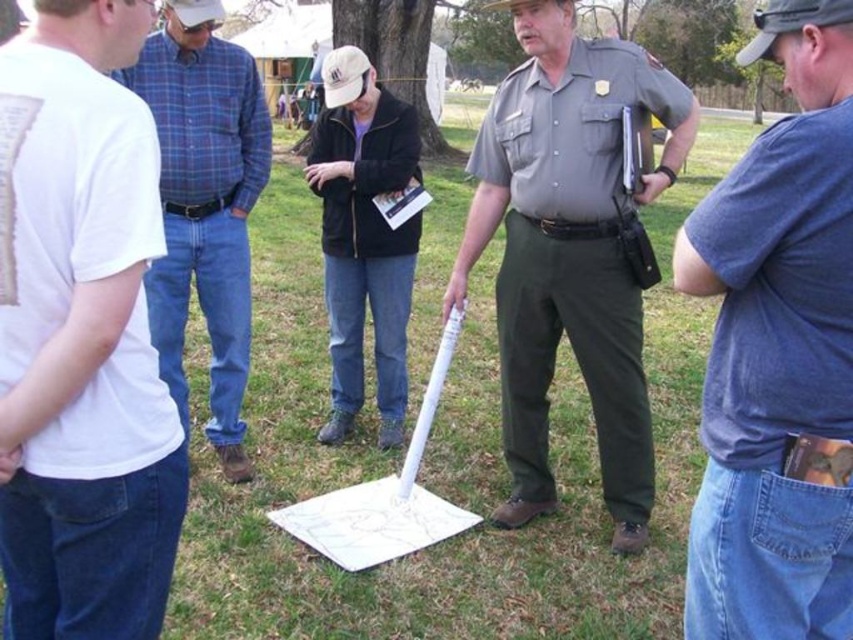
You are a photographer trying to capture a group photo of the blue plaid shirt at left and the black matte jacket at center. Which person should you position closer to the camera to ensure both appear equally tall in the photo?

The blue plaid shirt at left is much taller than the black matte jacket at center. To make them appear equally tall in the photo, position the black matte jacket at center closer to the camera than the blue plaid shirt at left.

You are standing at the point marked by coordinates (x=84, y=342) in the image. What object are you currently standing on?

The point at coordinates (x=84, y=342) is on the white t shirt at left.